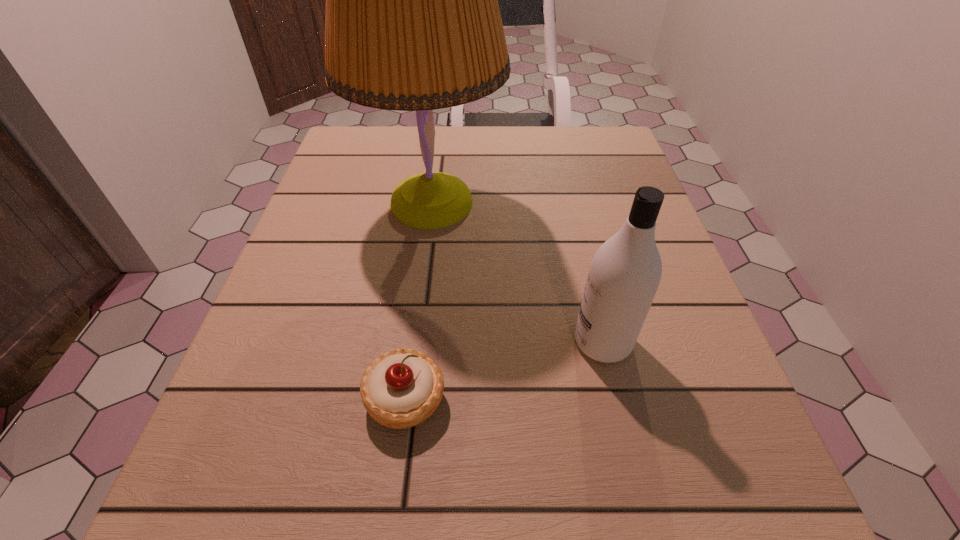
Locate an element on the screen. The image size is (960, 540). object present at the far edge is located at coordinates (412, 23).

You are a GUI agent. You are given a task and a screenshot of the screen. Output one action in this format:
    pyautogui.click(x=<x>, y=<y>)
    Task: Click on the object located in the left edge section of the desktop
    This screenshot has width=960, height=540.
    Given the screenshot: What is the action you would take?
    pyautogui.click(x=412, y=23)

Find the location of `object that is at the right edge`. object that is at the right edge is located at coordinates (625, 272).

Where is `object situated at the far left corner`? This screenshot has width=960, height=540. object situated at the far left corner is located at coordinates (412, 23).

Find the location of `free space at the far edge`. free space at the far edge is located at coordinates (460, 148).

Where is `vacant space at the near edge of the desktop`? The image size is (960, 540). vacant space at the near edge of the desktop is located at coordinates pyautogui.click(x=621, y=513).

In order to click on vacant space at the left edge in this screenshot , I will do `click(314, 198)`.

Where is `blank area at the right edge`? The width and height of the screenshot is (960, 540). blank area at the right edge is located at coordinates (578, 177).

This screenshot has width=960, height=540. Find the location of `vacant region at the far left corner of the desktop`. vacant region at the far left corner of the desktop is located at coordinates (375, 170).

This screenshot has width=960, height=540. I want to click on vacant region at the near left corner, so click(x=216, y=484).